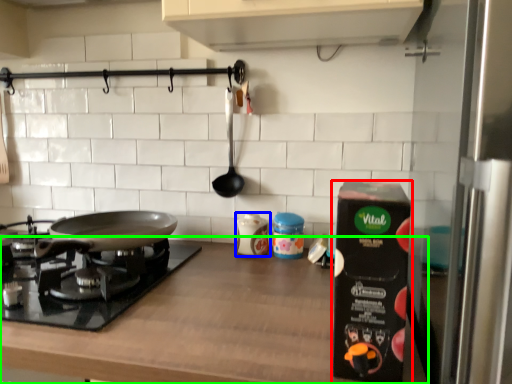
Question: Which object is positioned closest to kitchen appliance (highlighted by a red box)? Select from kitchen appliance (highlighted by a blue box) and countertop (highlighted by a green box).

Choices:
 (A) kitchen appliance
 (B) countertop

Answer: (B)